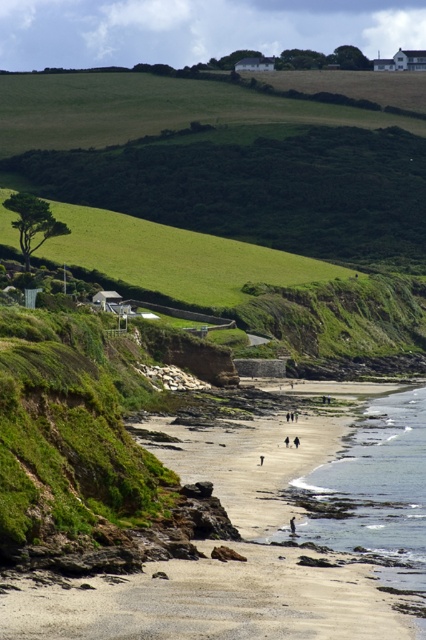
Question: Among these objects, which one is farthest from the camera?

Choices:
 (A) clear water at beach center
 (B) smooth sand beach at center

Answer: (A)

Question: Can you confirm if smooth sand beach at center is positioned to the right of clear water at beach center?

Choices:
 (A) no
 (B) yes

Answer: (A)

Question: Can you confirm if smooth sand beach at center is smaller than clear water at beach center?

Choices:
 (A) yes
 (B) no

Answer: (B)

Question: Which point is farther to the camera?

Choices:
 (A) smooth sand beach at center
 (B) clear water at beach center

Answer: (B)

Question: Does smooth sand beach at center appear under clear water at beach center?

Choices:
 (A) no
 (B) yes

Answer: (A)

Question: Which point is closer to the camera?

Choices:
 (A) (192, 632)
 (B) (400, 544)

Answer: (A)